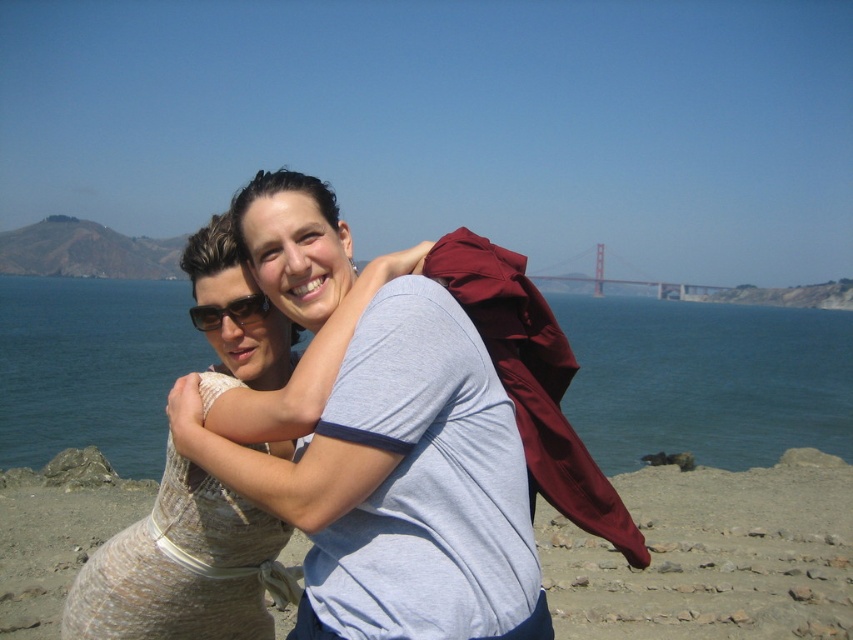
You are standing at the point with coordinates point (706, 289) and want to walk to the point with coordinates point (128, 449). Which direction should you move in to reach your destination?

You should move forward because point (128, 449) is in front of point (706, 289).